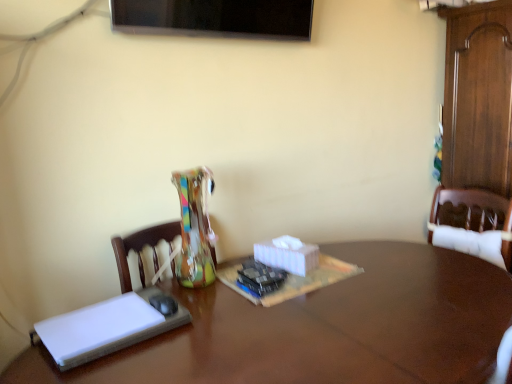
At what (x,y) coordinates should I click in order to perform the action: click on white matte book at left. Please return your answer as a coordinate pair (x, y). The image size is (512, 384). Looking at the image, I should click on (110, 326).

What do you see at coordinates (110, 326) in the screenshot? I see `white matte book at left` at bounding box center [110, 326].

Locate an element on the screen. The width and height of the screenshot is (512, 384). brown wooden table at center is located at coordinates pos(323,329).

Describe the element at coordinates (323, 329) in the screenshot. This screenshot has height=384, width=512. I see `brown wooden table at center` at that location.

Image resolution: width=512 pixels, height=384 pixels. Find the location of `white matte book at left`. white matte book at left is located at coordinates (110, 326).

Considering the relative positions of brown wooden table at center and white matte book at left in the image provided, is brown wooden table at center to the left or to the right of white matte book at left?

Clearly, brown wooden table at center is on the right of white matte book at left in the image.

Which is behind, brown wooden table at center or white matte book at left?

Answer: white matte book at left is further away from the camera.

Which point is more forward, (374, 257) or (162, 331)?

The point (162, 331) is closer.

Consider the image. From the image's perspective, who appears lower, brown wooden table at center or white matte book at left?

brown wooden table at center, from the image's perspective.

From a real-world perspective, is brown wooden table at center positioned under white matte book at left based on gravity?

Correct, in the physical world, brown wooden table at center is lower than white matte book at left.

Considering the relative sizes of brown wooden table at center and white matte book at left in the image provided, is brown wooden table at center wider than white matte book at left?

Yes.

In terms of height, does brown wooden table at center look taller or shorter compared to white matte book at left?

Clearly, brown wooden table at center is taller compared to white matte book at left.

Considering the sizes of brown wooden table at center and white matte book at left in the image, is brown wooden table at center bigger or smaller than white matte book at left?

Answer: Considering their sizes, brown wooden table at center takes up more space than white matte book at left.

Is brown wooden table at center not within white matte book at left?

Yes, brown wooden table at center is not within white matte book at left.

Is brown wooden table at center with white matte book at left?

No, brown wooden table at center is not in contact with white matte book at left.

Could you tell me if brown wooden table at center is facing white matte book at left?

No, brown wooden table at center does not turn towards white matte book at left.

Locate an element on the screen. This screenshot has height=384, width=512. table that is under the white matte book at left (from a real-world perspective) is located at coordinates (323, 329).

In the image, is white matte book at left on the left side or the right side of brown wooden table at center?

From the image, it's evident that white matte book at left is to the left of brown wooden table at center.

Relative to brown wooden table at center, is white matte book at left in front or behind?

In the image, white matte book at left appears behind brown wooden table at center.

Which is nearer, (161, 314) or (344, 341)?

Point (161, 314) is farther from the camera than point (344, 341).

From the image's perspective, which one is positioned lower, white matte book at left or brown wooden table at center?

brown wooden table at center, from the image's perspective.

From a real-world perspective, is white matte book at left located beneath brown wooden table at center?

No, from a real-world perspective, white matte book at left is not under brown wooden table at center.

From the picture: Looking at their sizes, would you say white matte book at left is wider or thinner than brown wooden table at center?

Considering their sizes, white matte book at left looks slimmer than brown wooden table at center.

Is white matte book at left shorter than brown wooden table at center?

Yes.

Does white matte book at left have a smaller size compared to brown wooden table at center?

Yes, white matte book at left is smaller than brown wooden table at center.

Is brown wooden table at center surrounded by white matte book at left?

No, brown wooden table at center is located outside of white matte book at left.

Are white matte book at left and brown wooden table at center located far from each other?

white matte book at left is actually quite close to brown wooden table at center.

Is white matte book at left oriented towards brown wooden table at center?

No, white matte book at left is not facing towards brown wooden table at center.

How different are the orientations of white matte book at left and brown wooden table at center in degrees?

The facing directions of white matte book at left and brown wooden table at center are 2.76 degrees apart.

Where is `book above the brown wooden table at center (from a real-world perspective)`? This screenshot has width=512, height=384. book above the brown wooden table at center (from a real-world perspective) is located at coordinates (110, 326).

This screenshot has width=512, height=384. I want to click on book that is behind the brown wooden table at center, so click(110, 326).

I want to click on book that appears on the left of brown wooden table at center, so click(x=110, y=326).